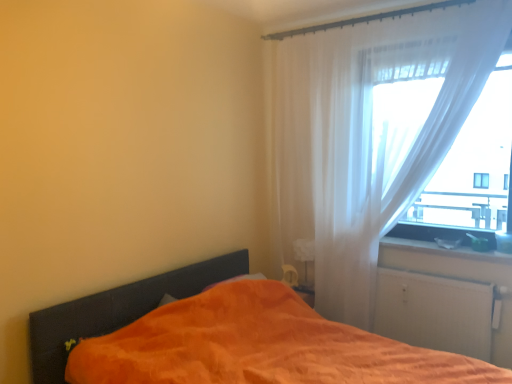
Locate an element on the screen. This screenshot has height=384, width=512. free location above white matte radiator at lower right (from a real-world perspective) is located at coordinates (444, 275).